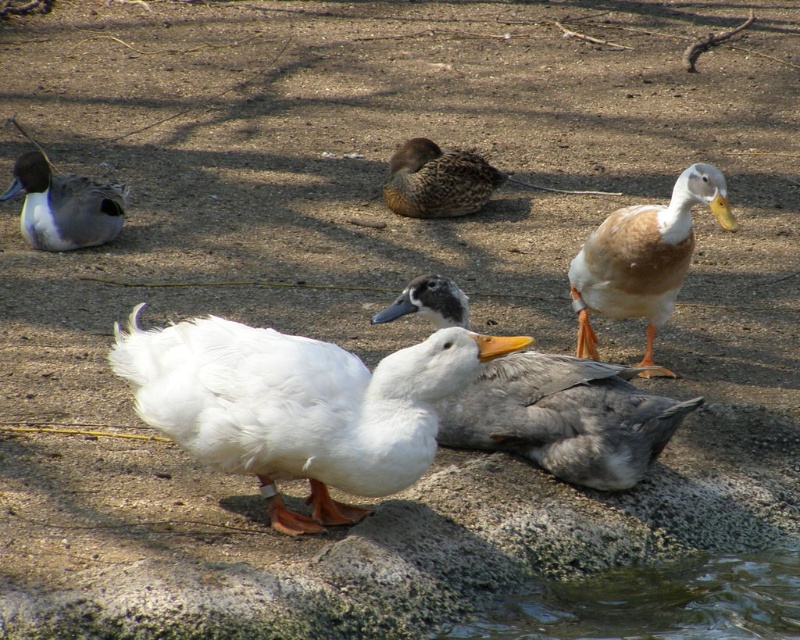
Between white fluffy goose at center and white matte duck at center, which one is positioned lower?

Positioned lower is white fluffy goose at center.

Does white fluffy goose at center appear over white matte duck at center?

Incorrect, white fluffy goose at center is not positioned above white matte duck at center.

Is point (390, 448) closer to viewer compared to point (636, 410)?

Yes, point (390, 448) is in front of point (636, 410).

Where is `white fluffy goose at center`? The image size is (800, 640). white fluffy goose at center is located at coordinates (297, 404).

Can you confirm if white matte duck at center is shorter than brown speckled duck at center?

Incorrect, white matte duck at center's height does not fall short of brown speckled duck at center's.

Does white matte duck at center appear over brown speckled duck at center?

Actually, white matte duck at center is below brown speckled duck at center.

Between point (594, 380) and point (464, 156), which one is positioned in front?

Positioned in front is point (594, 380).

Where is `white matte duck at center`? This screenshot has width=800, height=640. white matte duck at center is located at coordinates coord(566,417).

Is white fluffy goose at center smaller than brown matte duck at upper right?

Incorrect, white fluffy goose at center is not smaller in size than brown matte duck at upper right.

Can you confirm if white fluffy goose at center is positioned to the right of brown matte duck at upper right?

No, white fluffy goose at center is not to the right of brown matte duck at upper right.

Which is behind, point (145, 372) or point (596, 339)?

Positioned behind is point (596, 339).

At what (x,y) coordinates should I click in order to perform the action: click on white fluffy goose at center. Please return your answer as a coordinate pair (x, y). The width and height of the screenshot is (800, 640). Looking at the image, I should click on (297, 404).